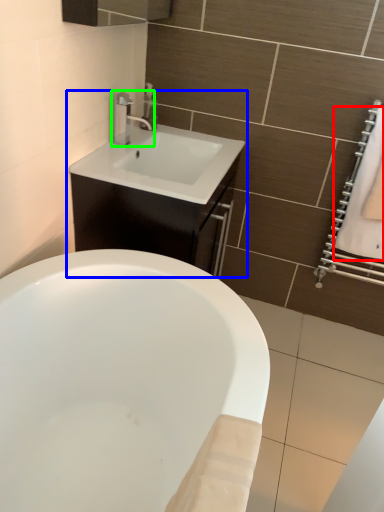
Question: Which object is positioned closest to bath towel (highlighted by a red box)? Select from bathroom cabinet (highlighted by a blue box) and tap (highlighted by a green box).

Choices:
 (A) bathroom cabinet
 (B) tap

Answer: (A)